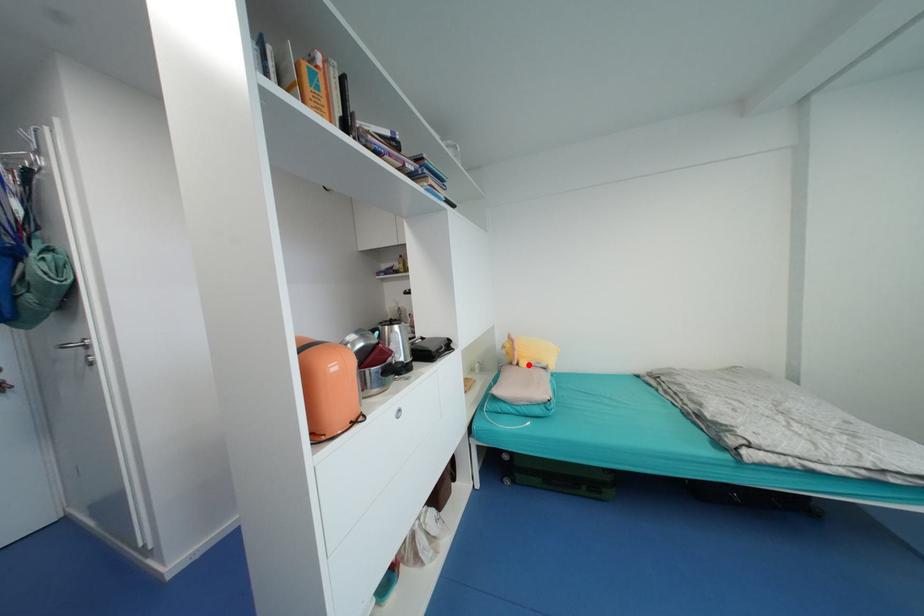
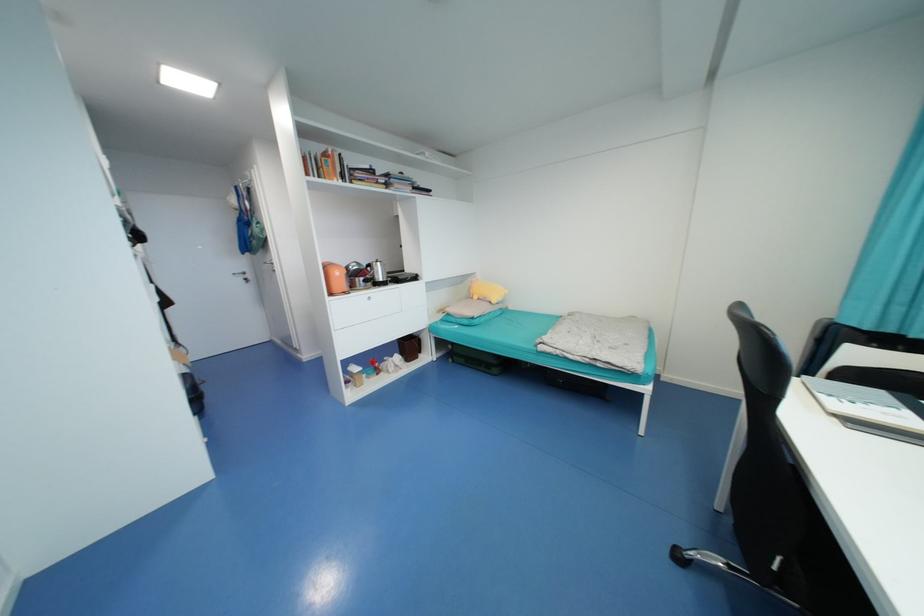
In the second image, find the point that corresponds to the highlighted location in the first image.

(480, 299)